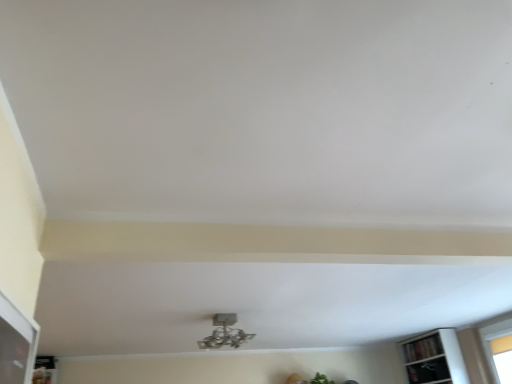
Question: Considering the positions of metallic silver chandelier at center and wooden bookshelf at lower right in the image, is metallic silver chandelier at center wider or thinner than wooden bookshelf at lower right?

Choices:
 (A) wide
 (B) thin

Answer: (A)

Question: Based on their positions, is metallic silver chandelier at center located to the left or right of wooden bookshelf at lower right?

Choices:
 (A) left
 (B) right

Answer: (A)

Question: Relative to wooden bookshelf at lower right, is metallic silver chandelier at center in front or behind?

Choices:
 (A) behind
 (B) front

Answer: (B)

Question: Considering the positions of wooden bookshelf at lower right and metallic silver chandelier at center in the image, is wooden bookshelf at lower right taller or shorter than metallic silver chandelier at center?

Choices:
 (A) short
 (B) tall

Answer: (A)

Question: In the image, is wooden bookshelf at lower right on the left side or the right side of metallic silver chandelier at center?

Choices:
 (A) left
 (B) right

Answer: (B)

Question: Is wooden bookshelf at lower right in front of or behind metallic silver chandelier at center in the image?

Choices:
 (A) front
 (B) behind

Answer: (B)

Question: In terms of size, does wooden bookshelf at lower right appear bigger or smaller than metallic silver chandelier at center?

Choices:
 (A) small
 (B) big

Answer: (A)